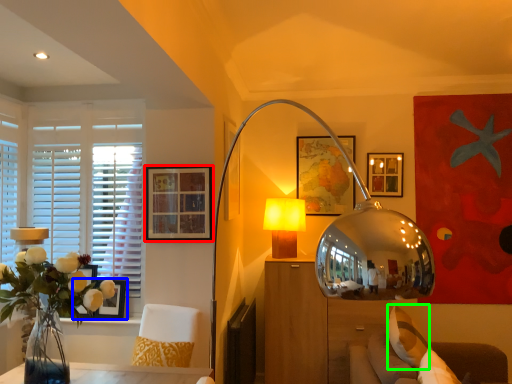
Question: Which is nearer to the picture frame (highlighted by a red box)? picture frame (highlighted by a blue box) or pillow (highlighted by a green box).

Choices:
 (A) picture frame
 (B) pillow

Answer: (A)